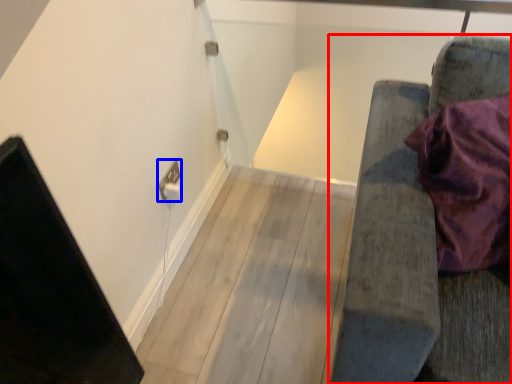
Question: Which object appears closest to the camera in this image, furniture (highlighted by a red box) or electric outlet (highlighted by a blue box)?

Choices:
 (A) furniture
 (B) electric outlet

Answer: (A)